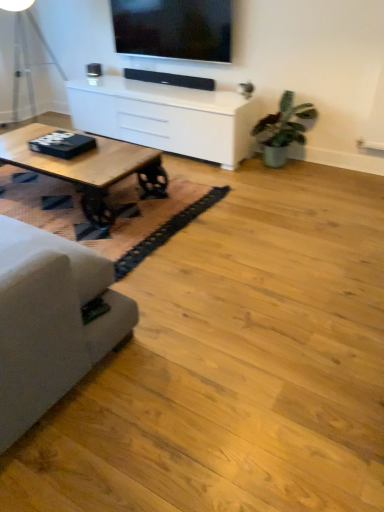
Question: Would you say metallic silver table lamp at left is part of matte black tv at upper center's contents?

Choices:
 (A) yes
 (B) no

Answer: (B)

Question: Does matte black tv at upper center have a lesser width compared to metallic silver table lamp at left?

Choices:
 (A) no
 (B) yes

Answer: (B)

Question: Can you confirm if matte black tv at upper center is bigger than metallic silver table lamp at left?

Choices:
 (A) yes
 (B) no

Answer: (B)

Question: Is matte black tv at upper center facing towards metallic silver table lamp at left?

Choices:
 (A) yes
 (B) no

Answer: (B)

Question: Does matte black tv at upper center have a greater height compared to metallic silver table lamp at left?

Choices:
 (A) no
 (B) yes

Answer: (A)

Question: Is matte black tv at upper center not inside metallic silver table lamp at left?

Choices:
 (A) no
 (B) yes

Answer: (B)

Question: Is green matte plant at right a part of black woven mat at lower left?

Choices:
 (A) yes
 (B) no

Answer: (B)

Question: Considering the relative positions of black woven mat at lower left and green matte plant at right in the image provided, is black woven mat at lower left in front of green matte plant at right?

Choices:
 (A) yes
 (B) no

Answer: (A)

Question: Is black woven mat at lower left shorter than green matte plant at right?

Choices:
 (A) yes
 (B) no

Answer: (A)

Question: Is black woven mat at lower left bigger than green matte plant at right?

Choices:
 (A) no
 (B) yes

Answer: (A)

Question: Would you consider black woven mat at lower left to be distant from green matte plant at right?

Choices:
 (A) no
 (B) yes

Answer: (B)

Question: Can you confirm if black woven mat at lower left is thinner than green matte plant at right?

Choices:
 (A) yes
 (B) no

Answer: (B)

Question: Is the depth of green matte plant at right greater than that of suede gray couch at left?

Choices:
 (A) yes
 (B) no

Answer: (A)